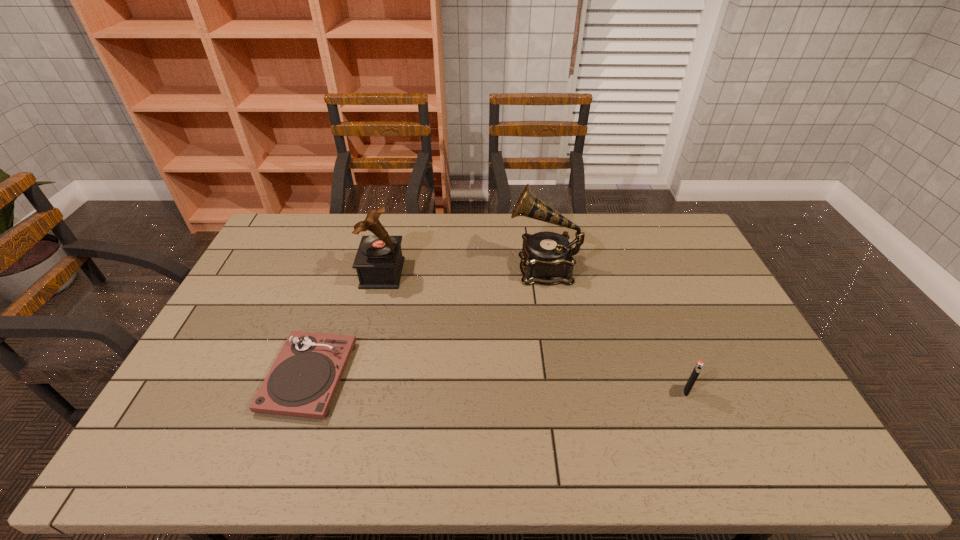
This screenshot has width=960, height=540. Identify the location of the third object from left to right. (546, 258).

Where is `the rightmost object`? the rightmost object is located at coordinates (696, 371).

The height and width of the screenshot is (540, 960). Identify the location of the second shortest object. (696, 371).

Locate an element on the screen. The width and height of the screenshot is (960, 540). the shortest phonograph_record is located at coordinates (302, 382).

Find the location of a particular element. The width and height of the screenshot is (960, 540). the shortest object is located at coordinates (302, 382).

Where is `vacant space located on the horn of the third object from left to right`? vacant space located on the horn of the third object from left to right is located at coordinates (457, 267).

Where is `free space located 0.370m on the horn of the third object from left to right`? The image size is (960, 540). free space located 0.370m on the horn of the third object from left to right is located at coordinates (402, 267).

You are a GUI agent. You are given a task and a screenshot of the screen. Output one action in this format:
    pyautogui.click(x=<x>, y=<y>)
    Task: Click on the vacant space located on the horn of the third object from left to right
    The width and height of the screenshot is (960, 540).
    Given the screenshot: What is the action you would take?
    pyautogui.click(x=451, y=267)

Locate an element on the screen. The width and height of the screenshot is (960, 540). blank space located 0.190m on the back of the rightmost object is located at coordinates (662, 331).

Identify the location of blank space located on the back of the nearest phonograph_record. The image size is (960, 540). (333, 306).